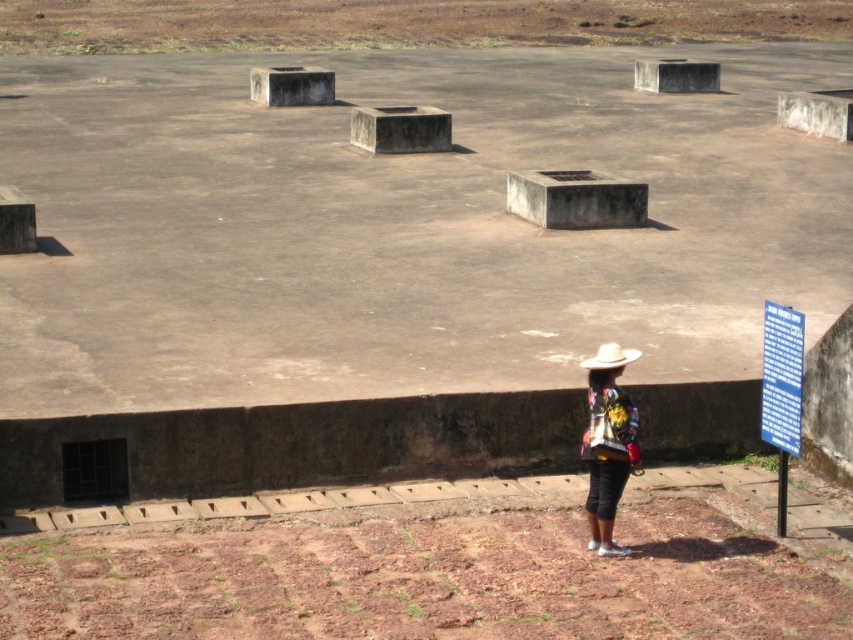
You are a gardener planning to plant flowers in the brown dirt field at upper center and the white matte cowboy hat at lower right. Which area is higher in elevation?

The brown dirt field at upper center is located above the white matte cowboy hat at lower right, so it has a higher elevation.

You are standing on the platform and want to move from the point at coordinates point (x=601, y=368) to the point at coordinates point (x=607, y=362). Which direction should you move to reach your destination?

To move from point (x=601, y=368) to point (x=607, y=362), you should move forward since point (x=601, y=368) is behind point (x=607, y=362).

You are a hiker who wants to place a 1.2m tall tent on the brown dirt field at upper center. Can you do it without the tent top exceeding the height of the floral fabric jacket at lower right?

The brown dirt field at upper center is much taller than the floral fabric jacket at lower right. If you place a 1.2m tall tent on the brown dirt field at upper center, the tent top will exceed the height of the floral fabric jacket at lower right.